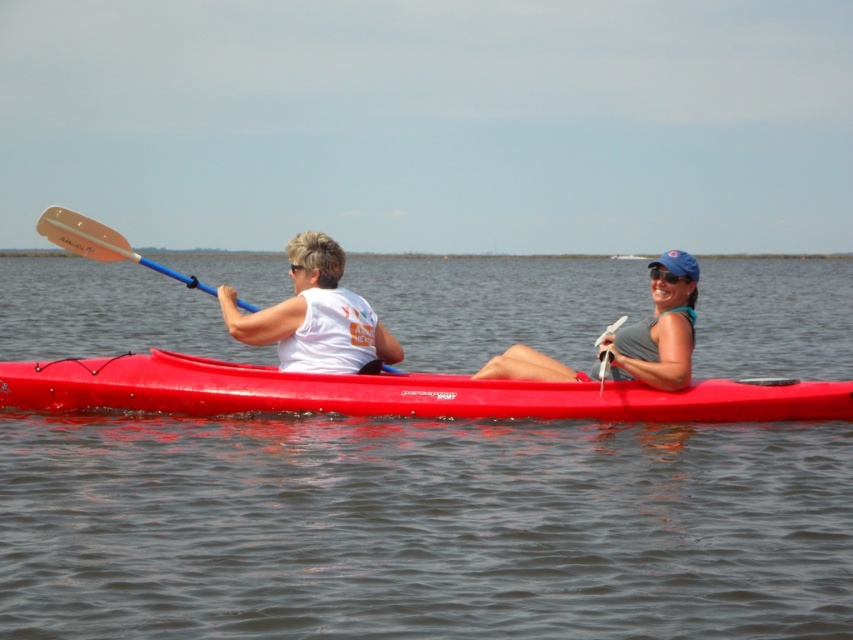
You are a photographer positioned 10 meters away from the kayakers. You want to capture a photo where both the transparent water at center and the white matte tank top at center are in focus. Given that your camera can only focus on objects within a 10 meter range, will both subjects be in focus?

The transparent water at center is 19.45 meters away from the white matte tank top at center. Since you are 10 meters away from the kayakers, the white matte tank top at center is within your camera range. However, the transparent water at center is 19.45 meters further away, placing it beyond the 10 meter focus range. Therefore, only the white matte tank top at center will be in focus.